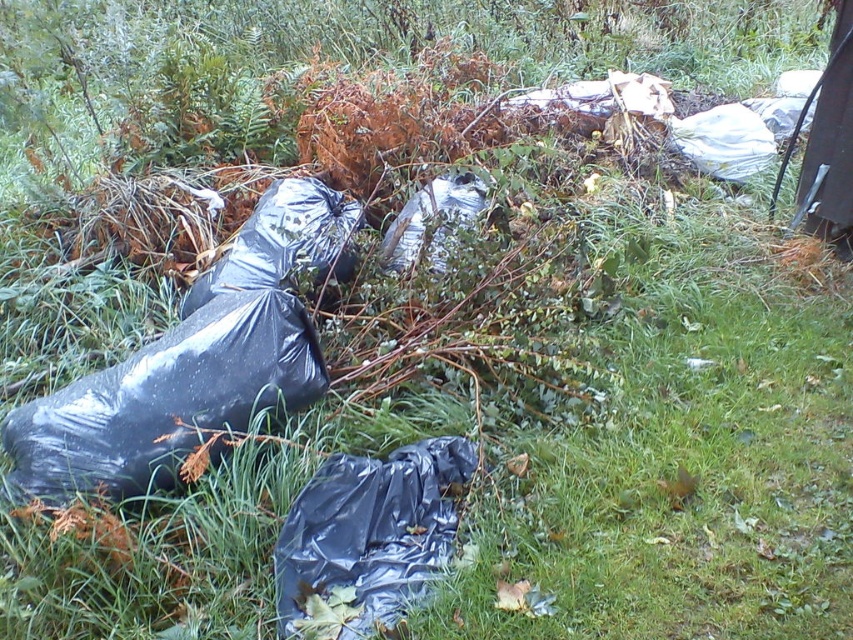
Between black plastic bag at left and black plastic bag at lower center, which one appears on the right side from the viewer's perspective?

Positioned to the right is black plastic bag at lower center.

Identify the location of black plastic bag at left. The width and height of the screenshot is (853, 640). pos(165,400).